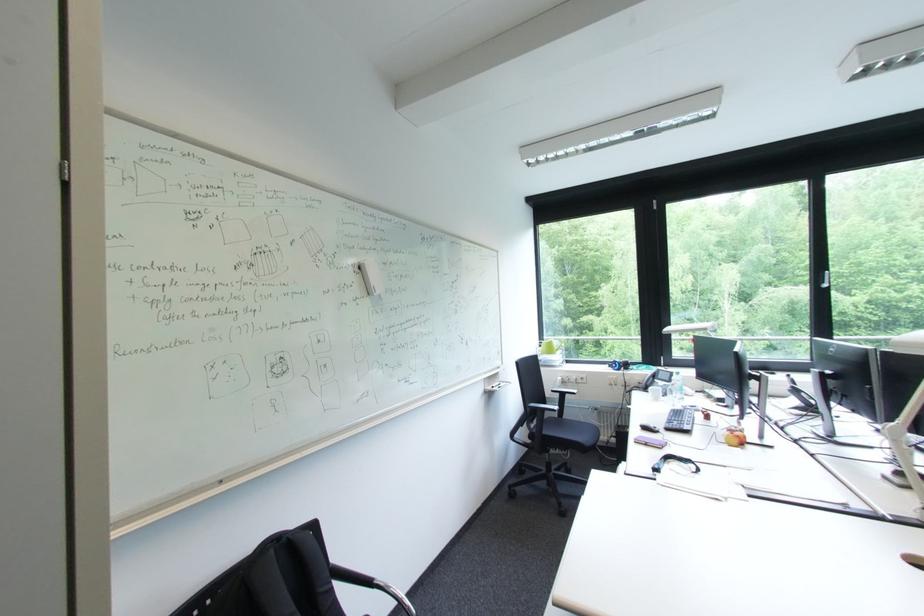
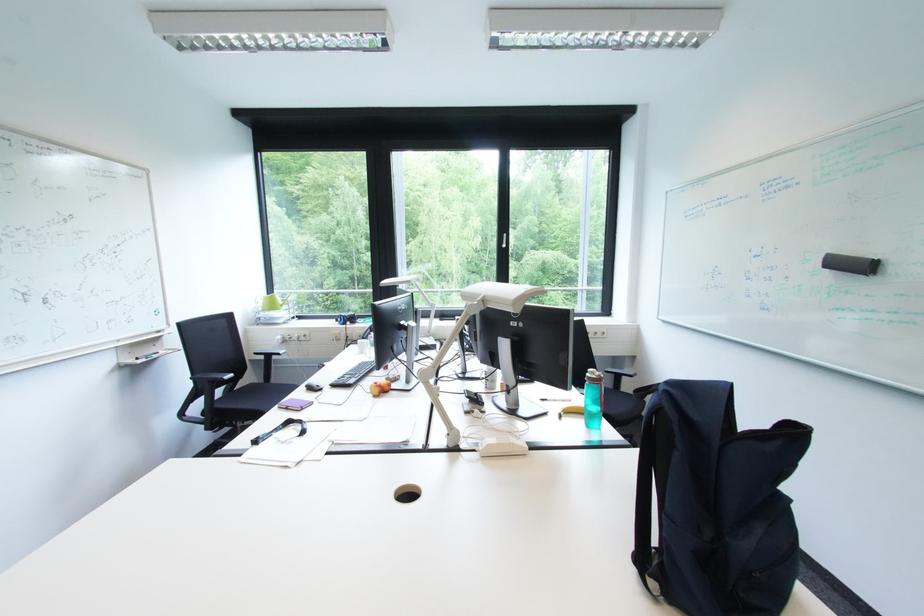
Where in the second image is the point corresponding to [833,286] from the first image?

(514, 248)